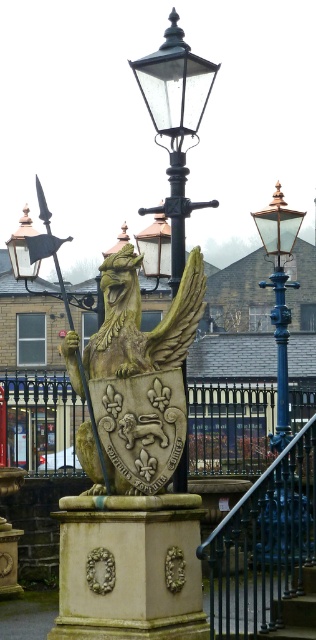
You are standing in front of the historical streetlamp and want to take a photo. You notice two points marked on the lamppost at coordinates point (225, 545) and point (178, 45). Which point is closer to your camera lens when you aim at the lamppost?

The point (225, 545) is closer to the camera than point (178, 45).